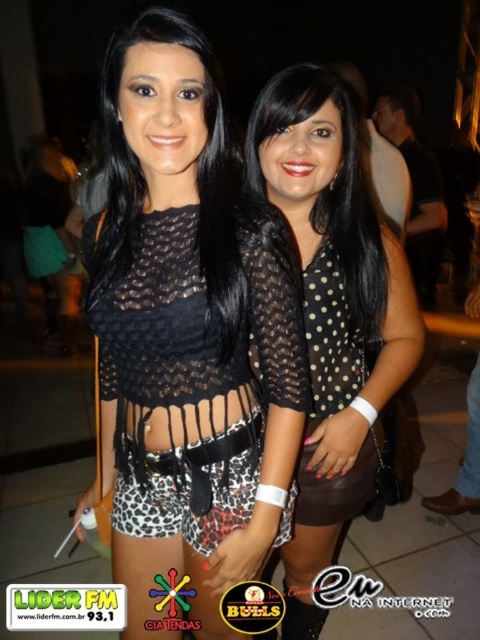
Question: Which object appears closest to the camera in this image?

Choices:
 (A) black lace top at center
 (B) leopard print shorts at center

Answer: (B)

Question: Is black dotted shirt at center closer to the viewer compared to black dotted sheer blouse at center?

Choices:
 (A) no
 (B) yes

Answer: (B)

Question: Which object appears farthest from the camera in this image?

Choices:
 (A) black dotted sheer blouse at center
 (B) leopard print shorts at center
 (C) black dotted shirt at center

Answer: (A)

Question: Can you confirm if black lace top at center is positioned above black dotted sheer blouse at center?

Choices:
 (A) no
 (B) yes

Answer: (B)

Question: Estimate the real-world distances between objects in this image. Which object is closer to the leopard print shorts at center?

Choices:
 (A) black dotted sheer blouse at center
 (B) black dotted shirt at center
 (C) black lace top at center

Answer: (C)

Question: Does black lace top at center lie in front of black dotted sheer blouse at center?

Choices:
 (A) no
 (B) yes

Answer: (B)